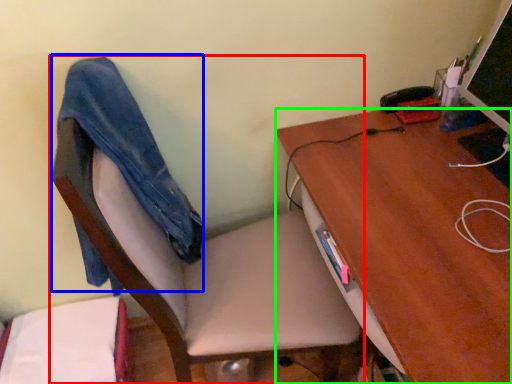
Question: Considering the real-world distances, which object is farthest from chair (highlighted by a red box)? jeans (highlighted by a blue box) or desk (highlighted by a green box)?

Choices:
 (A) jeans
 (B) desk

Answer: (B)